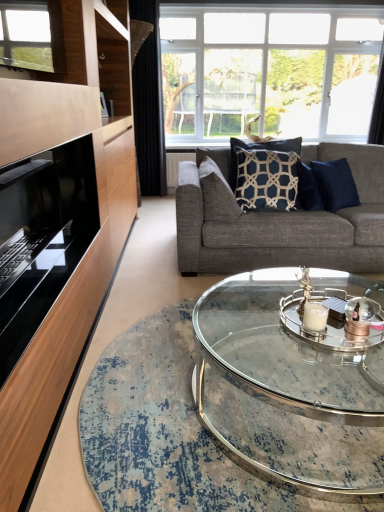
This screenshot has width=384, height=512. I want to click on black glass fireplace at left, so click(42, 238).

The width and height of the screenshot is (384, 512). In order to click on black fabric curtain at left, which ranks as the first curtain in left-to-right order in this screenshot , I will do `click(149, 103)`.

Locate an element on the screen. clear glass coffee table at center is located at coordinates (289, 387).

Could you tell me if black glass fireplace at left is turned towards navy blue fabric pillow at center, the 2th pillow in the left-to-right sequence?

No, black glass fireplace at left does not turn towards navy blue fabric pillow at center, the 2th pillow in the left-to-right sequence.

Considering the positions of point (52, 163) and point (241, 155), is point (52, 163) closer or farther from the camera than point (241, 155)?

Point (52, 163) appears to be closer to the viewer than point (241, 155).

Where is `the 2nd pillow behind when counting from the black glass fireplace at left`? This screenshot has width=384, height=512. the 2nd pillow behind when counting from the black glass fireplace at left is located at coordinates (266, 179).

Which point is more distant from viewer, (218,169) or (359,316)?

The point (218,169) is farther from the camera.

From a real-world perspective, which object stands above the other?

blue textured pillow at center, which is counted as the 2th pillow, starting from the right.

Could you tell me if blue textured pillow at center, placed as the 1th pillow when sorted from left to right, is turned towards clear glass candle holder at center?

No, blue textured pillow at center, placed as the 1th pillow when sorted from left to right, is not aimed at clear glass candle holder at center.

Identify the location of fireplace in front of the black fabric curtain at left, which ranks as the first curtain in left-to-right order. (42, 238).

Is black glass fireplace at left next to black fabric curtain at left, which ranks as the first curtain in left-to-right order, and touching it?

No, black glass fireplace at left is not touching black fabric curtain at left, which ranks as the first curtain in left-to-right order.

Does point (49, 269) lie in front of point (151, 130)?

Yes, point (49, 269) is closer to viewer.

Considering the relative sizes of blue textured pillow at center, placed as the 1th pillow when sorted from left to right, and black fabric curtain at left, which ranks as the second curtain in right-to-left order, in the image provided, is blue textured pillow at center, placed as the 1th pillow when sorted from left to right, shorter than black fabric curtain at left, which ranks as the second curtain in right-to-left order,?

Correct, blue textured pillow at center, placed as the 1th pillow when sorted from left to right, is not as tall as black fabric curtain at left, which ranks as the second curtain in right-to-left order.

Does point (210, 193) lie behind point (133, 81)?

No, (210, 193) is in front of (133, 81).

Based on their sizes in the image, would you say blue textured pillow at center, placed as the 1th pillow when sorted from left to right, is bigger or smaller than black fabric curtain at left, which ranks as the first curtain in left-to-right order?

In the image, blue textured pillow at center, placed as the 1th pillow when sorted from left to right, appears to be smaller than black fabric curtain at left, which ranks as the first curtain in left-to-right order.

Is blue textured pillow at center, placed as the 1th pillow when sorted from left to right, further to camera compared to black fabric curtain at left, which ranks as the second curtain in right-to-left order?

No, it is not.

From the image's perspective, who appears lower, clear glass window at upper center or textured gray couch at center?

textured gray couch at center appears lower in the image.

Can textured gray couch at center be found inside clear glass window at upper center?

No, textured gray couch at center is not a part of clear glass window at upper center.

Considering the sizes of objects clear glass window at upper center and textured gray couch at center in the image provided, who is wider, clear glass window at upper center or textured gray couch at center?

With larger width is textured gray couch at center.

From the image's perspective, is navy blue fabric pillow at center, the first pillow viewed from the right, above black fabric curtain at left, which ranks as the second curtain in right-to-left order?

No, from the image's perspective, navy blue fabric pillow at center, the first pillow viewed from the right, is not on top of black fabric curtain at left, which ranks as the second curtain in right-to-left order.

Identify the location of curtain on the left of navy blue fabric pillow at center, the 2th pillow in the left-to-right sequence. 149,103.

Is navy blue fabric pillow at center, the 2th pillow in the left-to-right sequence, looking in the opposite direction of black fabric curtain at left, which ranks as the first curtain in left-to-right order?

Yes.

Looking at this image, is clear glass candle holder at center to the right of clear glass window at upper center from the viewer's perspective?

No, clear glass candle holder at center is not to the right of clear glass window at upper center.

Does clear glass candle holder at center have a smaller size compared to clear glass window at upper center?

Yes, clear glass candle holder at center is smaller than clear glass window at upper center.

Which is behind, point (366, 312) or point (357, 79)?

The point (357, 79) is farther.

From the image's perspective, would you say clear glass candle holder at center is shown under clear glass window at upper center?

Indeed, from the image's perspective, clear glass candle holder at center is shown beneath clear glass window at upper center.

Identify the location of fireplace that appears above the navy blue fabric pillow at center, the 2th pillow in the left-to-right sequence (from a real-world perspective). This screenshot has width=384, height=512. (42, 238).

This screenshot has width=384, height=512. In order to click on candle holder lying on the right of blue textured pillow at center, placed as the 1th pillow when sorted from left to right in this screenshot , I will do `click(357, 319)`.

Based on their spatial positions, is navy blue fabric pillow at center, the first pillow viewed from the right, or black fabric curtain at upper right, arranged as the 2th curtain when viewed from the left, closer to black fabric curtain at left, which ranks as the second curtain in right-to-left order?

The object closer to black fabric curtain at left, which ranks as the second curtain in right-to-left order, is navy blue fabric pillow at center, the first pillow viewed from the right.

Based on their spatial positions, is navy blue fabric pillow at center, the first pillow viewed from the right, or textured gray couch at center further from black glass fireplace at left?

navy blue fabric pillow at center, the first pillow viewed from the right, is further to black glass fireplace at left.

Estimate the real-world distances between objects in this image. Which object is closer to black glass fireplace at left, textured gray couch at center or clear glass coffee table at center?

clear glass coffee table at center.

Based on their spatial positions, is clear glass candle holder at center or blue textured pillow at center, which is counted as the 2th pillow, starting from the right, further from black glass fireplace at left?

The object further to black glass fireplace at left is clear glass candle holder at center.

Estimate the real-world distances between objects in this image. Which object is further from clear glass candle holder at center, black fabric curtain at upper right, arranged as the 2th curtain when viewed from the left, or clear glass coffee table at center?

Among the two, black fabric curtain at upper right, arranged as the 2th curtain when viewed from the left, is located further to clear glass candle holder at center.

Based on their spatial positions, is blue textured pillow at center, placed as the 1th pillow when sorted from left to right, or clear glass candle holder at center further from clear glass coffee table at center?

blue textured pillow at center, placed as the 1th pillow when sorted from left to right, is positioned further to the anchor clear glass coffee table at center.

From the image, which object appears to be nearer to black fabric curtain at upper right, marked as the first curtain in a right-to-left arrangement, black fabric curtain at left, which ranks as the second curtain in right-to-left order, or clear glass candle holder at center?

black fabric curtain at left, which ranks as the second curtain in right-to-left order, is closer to black fabric curtain at upper right, marked as the first curtain in a right-to-left arrangement.

Considering their positions, is clear glass coffee table at center positioned further to blue textured pillow at center, which is counted as the 2th pillow, starting from the right, than black fabric curtain at left, which ranks as the second curtain in right-to-left order?

black fabric curtain at left, which ranks as the second curtain in right-to-left order.

Find the location of `candle holder between black glass fireplace at left and black fabric curtain at left, which ranks as the second curtain in right-to-left order, from front to back`. candle holder between black glass fireplace at left and black fabric curtain at left, which ranks as the second curtain in right-to-left order, from front to back is located at coordinates (357, 319).

This screenshot has height=512, width=384. In order to click on candle holder located between clear glass coffee table at center and blue textured pillow at center, which is counted as the 2th pillow, starting from the right, in the depth direction in this screenshot , I will do `click(357, 319)`.

I want to click on coffee table located between black glass fireplace at left and clear glass window at upper center in the depth direction, so click(289, 387).

Find the location of a particular element. This screenshot has width=384, height=512. studio couch located between clear glass coffee table at center and black fabric curtain at left, which ranks as the second curtain in right-to-left order, in the depth direction is located at coordinates (283, 223).